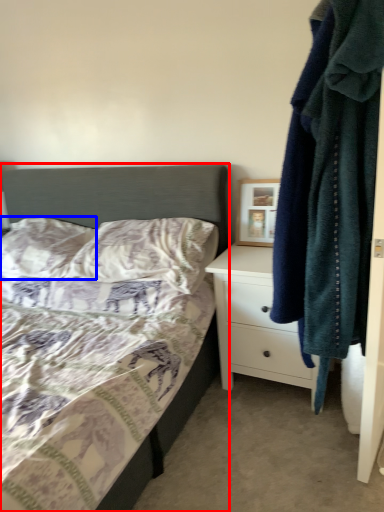
Question: Which object is closer to the camera taking this photo, bed (highlighted by a red box) or pillow (highlighted by a blue box)?

Choices:
 (A) bed
 (B) pillow

Answer: (A)